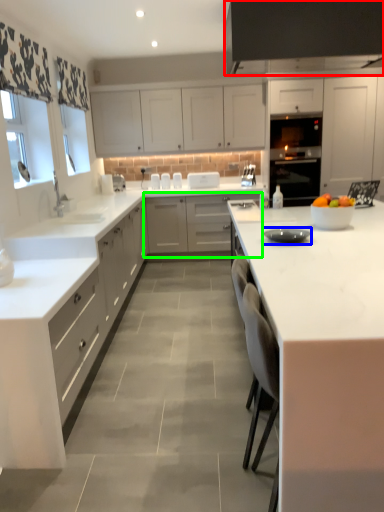
Question: Based on their relative distances, which object is nearer to exhaust hood (highlighted by a red box)? Choose from appliance (highlighted by a blue box) and cabinetry (highlighted by a green box).

Choices:
 (A) appliance
 (B) cabinetry

Answer: (A)